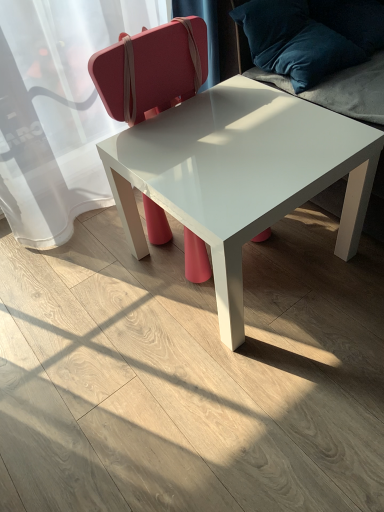
Measure the distance between velvet blue pillow at upper right and camera.

A distance of 3.69 feet exists between velvet blue pillow at upper right and camera.

Where is `matte pink suitcase at center`? matte pink suitcase at center is located at coordinates (151, 69).

Where is `coffee table that is under the velvet blue pillow at upper right (from a real-world perspective)`? coffee table that is under the velvet blue pillow at upper right (from a real-world perspective) is located at coordinates (240, 174).

Is velvet blue pillow at upper right located outside white glossy table at center?

Absolutely, velvet blue pillow at upper right is external to white glossy table at center.

Is point (354, 80) behind point (170, 183)?

Yes.

Which is more to the right, velvet blue pillow at upper right or matte pink suitcase at center?

velvet blue pillow at upper right is more to the right.

Looking at this image, which of these two, velvet blue pillow at upper right or matte pink suitcase at center, stands shorter?

With less height is velvet blue pillow at upper right.

In the scene shown: Which object is wider, velvet blue pillow at upper right or matte pink suitcase at center?

With larger width is velvet blue pillow at upper right.

From a real-world perspective, is velvet blue pillow at upper right physically located above or below matte pink suitcase at center?

Clearly, from a real-world perspective, velvet blue pillow at upper right is above matte pink suitcase at center.

Who is smaller, white glossy table at center or matte pink suitcase at center?

With smaller size is matte pink suitcase at center.

Is white glossy table at center positioned with its back to matte pink suitcase at center?

Yes, white glossy table at center is positioned with its back facing matte pink suitcase at center.

Which of these two, white glossy table at center or matte pink suitcase at center, stands taller?

matte pink suitcase at center is taller.

Is white glossy table at center aimed at velvet blue pillow at upper right?

No, white glossy table at center is not facing towards velvet blue pillow at upper right.

Considering the sizes of objects white glossy table at center and velvet blue pillow at upper right in the image provided, who is smaller, white glossy table at center or velvet blue pillow at upper right?

velvet blue pillow at upper right.

Identify the location of swivel chair positioned vertically above the matte pink suitcase at center (from a real-world perspective). (354, 91).

Based on the photo, is velvet blue pillow at upper right inside matte pink suitcase at center?

Definitely not — velvet blue pillow at upper right is not inside matte pink suitcase at center.

Looking at their sizes, would you say matte pink suitcase at center is wider or thinner than velvet blue pillow at upper right?

Considering their sizes, matte pink suitcase at center looks slimmer than velvet blue pillow at upper right.

From the image's perspective, would you say matte pink suitcase at center is shown under white glossy table at center?

No, from the image's perspective, matte pink suitcase at center is not beneath white glossy table at center.

What's the angular difference between matte pink suitcase at center and white glossy table at center's facing directions?

The facing directions of matte pink suitcase at center and white glossy table at center are 3.85e-05 degrees apart.

From a real-world perspective, is matte pink suitcase at center positioned above or below white glossy table at center?

matte pink suitcase at center is above white glossy table at center.

Locate an element on the screen. The width and height of the screenshot is (384, 512). coffee table located underneath the velvet blue pillow at upper right (from a real-world perspective) is located at coordinates (240, 174).

This screenshot has width=384, height=512. Find the location of `chair on the left side of velvet blue pillow at upper right`. chair on the left side of velvet blue pillow at upper right is located at coordinates (151, 69).

When comparing their distances from matte pink suitcase at center, does velvet blue pillow at upper right or white glossy table at center seem closer?

white glossy table at center lies closer to matte pink suitcase at center than the other object.

When comparing their distances from matte pink suitcase at center, does white glossy table at center or velvet blue pillow at upper right seem further?

velvet blue pillow at upper right is further to matte pink suitcase at center.

Estimate the real-world distances between objects in this image. Which object is closer to white glossy table at center, velvet blue pillow at upper right or matte pink suitcase at center?

velvet blue pillow at upper right lies closer to white glossy table at center than the other object.

Looking at the image, which one is located closer to velvet blue pillow at upper right, white glossy table at center or matte pink suitcase at center?

Based on the image, white glossy table at center appears to be nearer to velvet blue pillow at upper right.

Considering their positions, is matte pink suitcase at center positioned further to white glossy table at center than velvet blue pillow at upper right?

Based on the image, matte pink suitcase at center appears to be further to white glossy table at center.

Estimate the real-world distances between objects in this image. Which object is closer to velvet blue pillow at upper right, matte pink suitcase at center or white glossy table at center?

white glossy table at center.

What are the coordinates of `chair between velvet blue pillow at upper right and white glossy table at center in the up-down direction` in the screenshot? It's located at (151, 69).